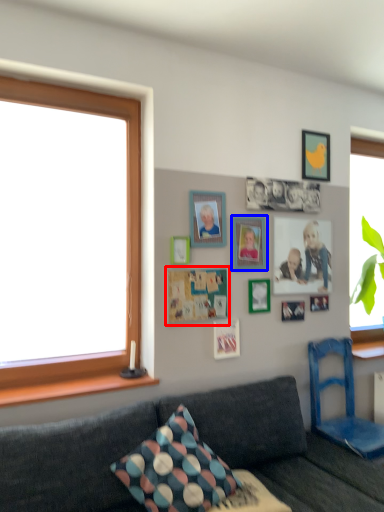
Question: Which of the following is the farthest to the observer, bulletin board (highlighted by a red box) or picture frame (highlighted by a blue box)?

Choices:
 (A) bulletin board
 (B) picture frame

Answer: (B)